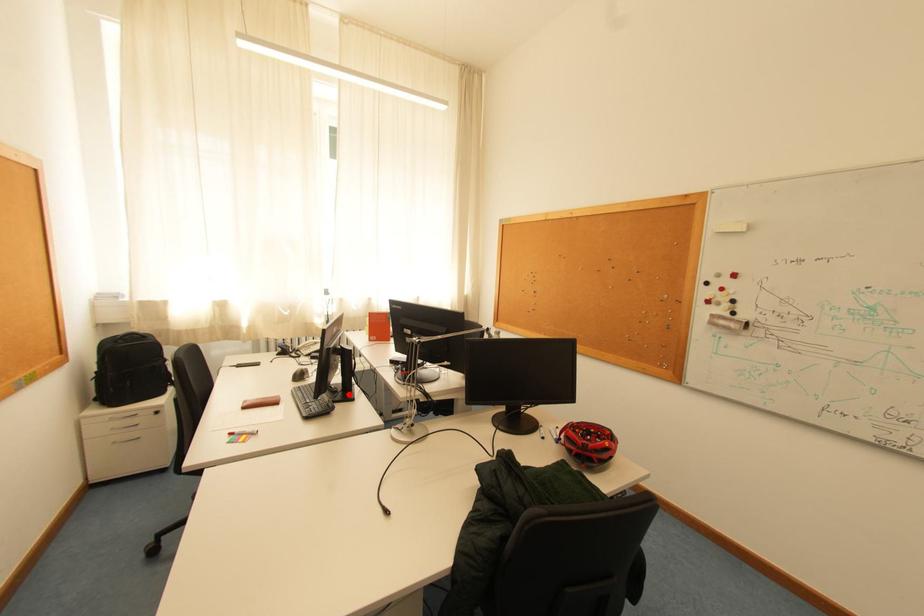
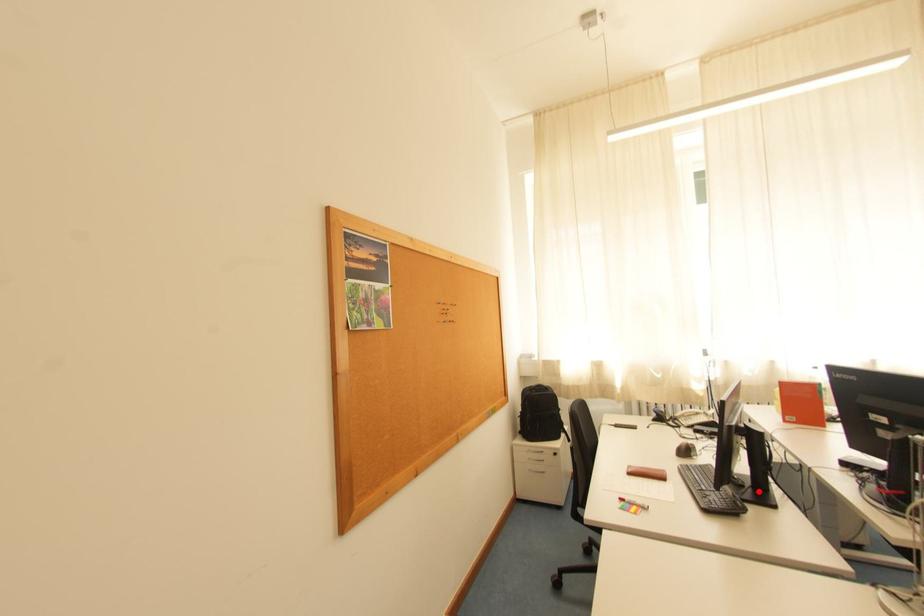
I am providing you with two images of the same scene from different viewpoints. A red point is marked on the first image and another point is marked on the second image. Do the highlighted points in image1 and image2 indicate the same real-world spot?

Yes